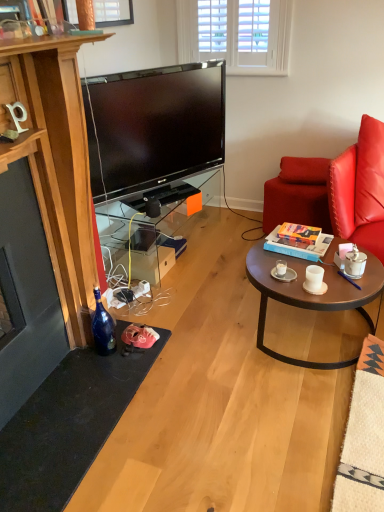
The image size is (384, 512). I want to click on vacant space in front of purple plastic pen at coffee table, so click(x=355, y=291).